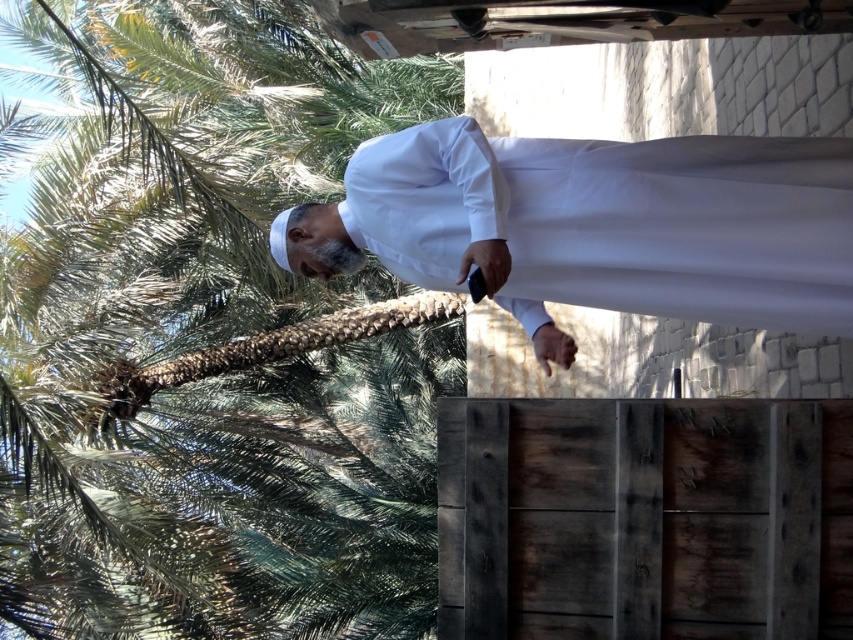
Is green leafy palm tree at upper left positioned in front of white matte/soft fabric at center?

No.

Find the location of a particular element. green leafy palm tree at upper left is located at coordinates (206, 337).

Is point (128, 134) positioned before point (444, 259)?

No, it is not.

Where is `green leafy palm tree at upper left`? This screenshot has width=853, height=640. green leafy palm tree at upper left is located at coordinates (206, 337).